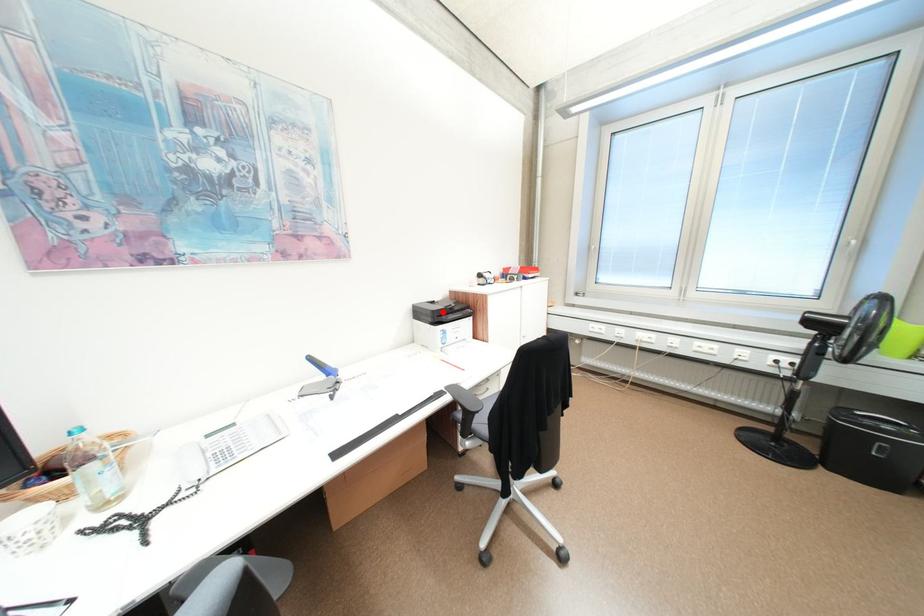
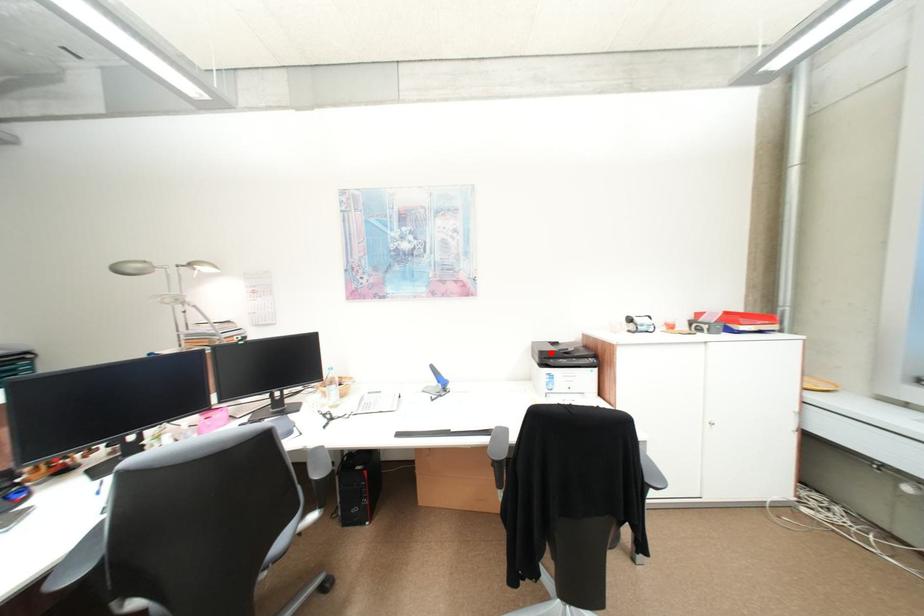
I am providing you with two images of the same scene from different viewpoints. A red point is marked on the first image and another point is marked on the second image. Is the marked point in image1 the same physical position as the marked point in image2?

Yes